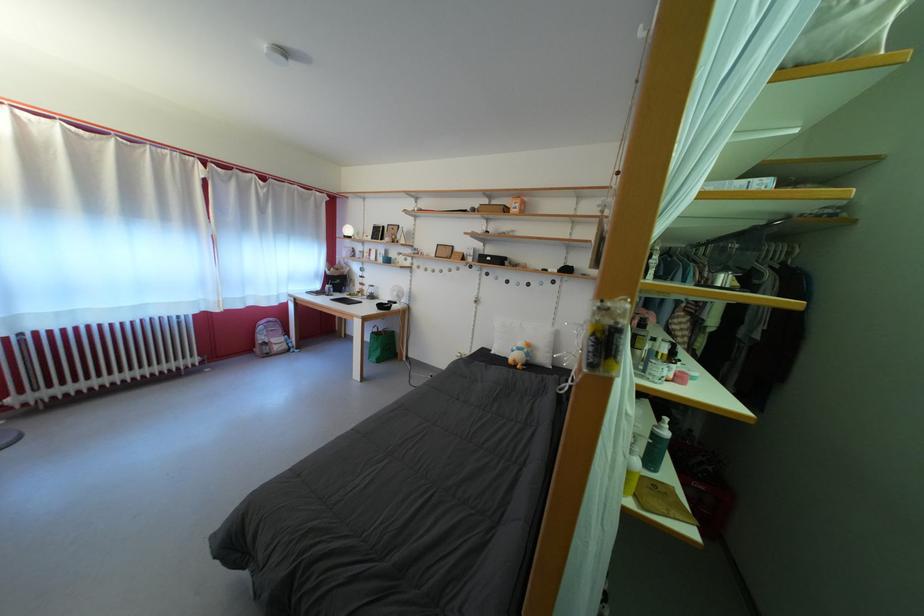
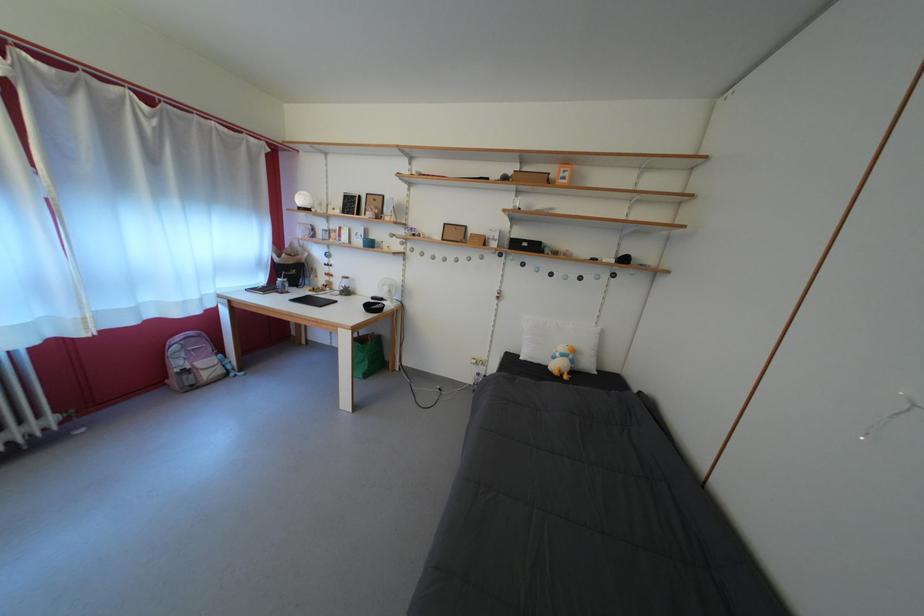
Which direction would the cameraman need to move to produce the second image?

The cameraman walked toward left, forward.